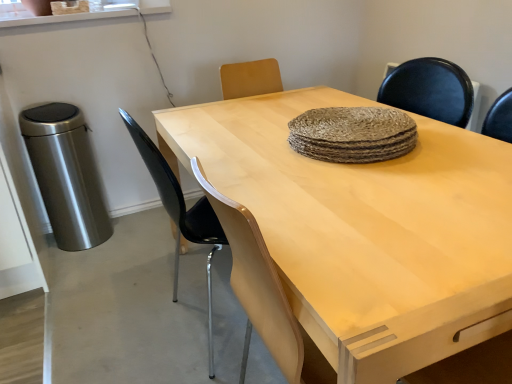
The height and width of the screenshot is (384, 512). In order to click on vacant area on top of light wood table at center (from a real-world perspective) in this screenshot , I will do `click(338, 161)`.